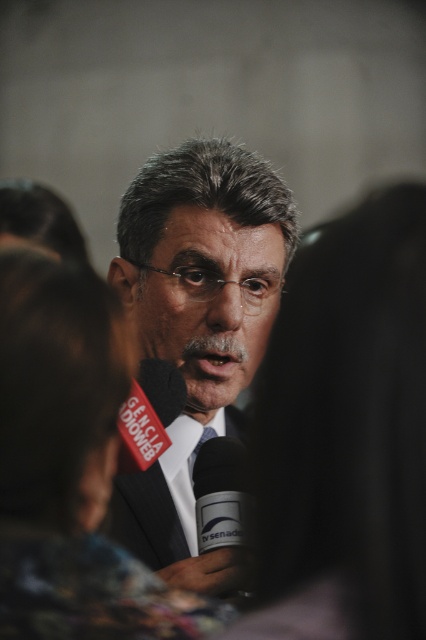
You are a photographer trying to capture a clear shot of the blue silk tie at center. However, the black matte microphone at center is blocking your view. Can you move the microphone to the side to get a clear shot?

The black matte microphone at center is in front of the blue silk tie at center, so moving it to the side would allow you to see the blue silk tie at center clearly.

You are a photographer trying to capture a clear shot of the black matte microphone at center. Since the black matte suit at lower center is in the way, can you move the microphone to the side to get it out of the frame? Explain your reasoning based on their sizes.

The black matte suit at lower center is larger in size than the black matte microphone at center. Moving the microphone to the side might not be feasible because the suit is bigger and could still block the microphone or require significant repositioning to clear the frame.